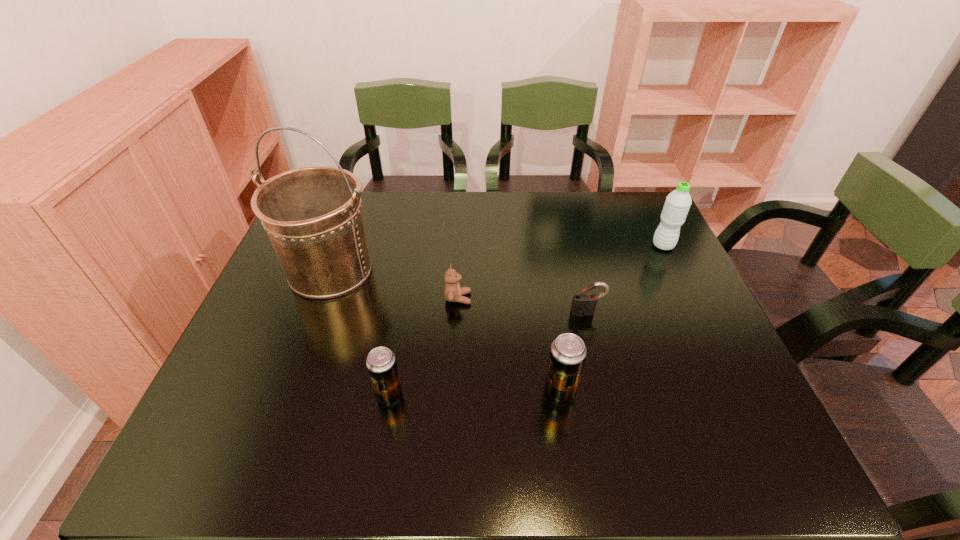
The height and width of the screenshot is (540, 960). Identify the location of the left beer can. (381, 364).

Where is `the second object from left to right`? The height and width of the screenshot is (540, 960). the second object from left to right is located at coordinates (381, 364).

Find the location of a particular element. the right beer can is located at coordinates (567, 356).

The image size is (960, 540). Find the location of `the taller beer can`. the taller beer can is located at coordinates (567, 356).

The image size is (960, 540). I want to click on water bottle, so click(x=677, y=204).

At what (x,y) coordinates should I click in order to perform the action: click on the rightmost object. Please return your answer as a coordinate pair (x, y). This screenshot has width=960, height=540. Looking at the image, I should click on (677, 204).

Where is `padlock`? padlock is located at coordinates (583, 304).

At what (x,y) coordinates should I click in order to perform the action: click on the third object from left to right. Please return your answer as a coordinate pair (x, y). Image resolution: width=960 pixels, height=540 pixels. Looking at the image, I should click on (453, 292).

You are a GUI agent. You are given a task and a screenshot of the screen. Output one action in this format:
    pyautogui.click(x=<x>, y=<y>)
    Task: Click on the tallest object
    This screenshot has width=960, height=540.
    Given the screenshot: What is the action you would take?
    pyautogui.click(x=313, y=216)

Identify the location of the leftmost object. This screenshot has width=960, height=540. (313, 216).